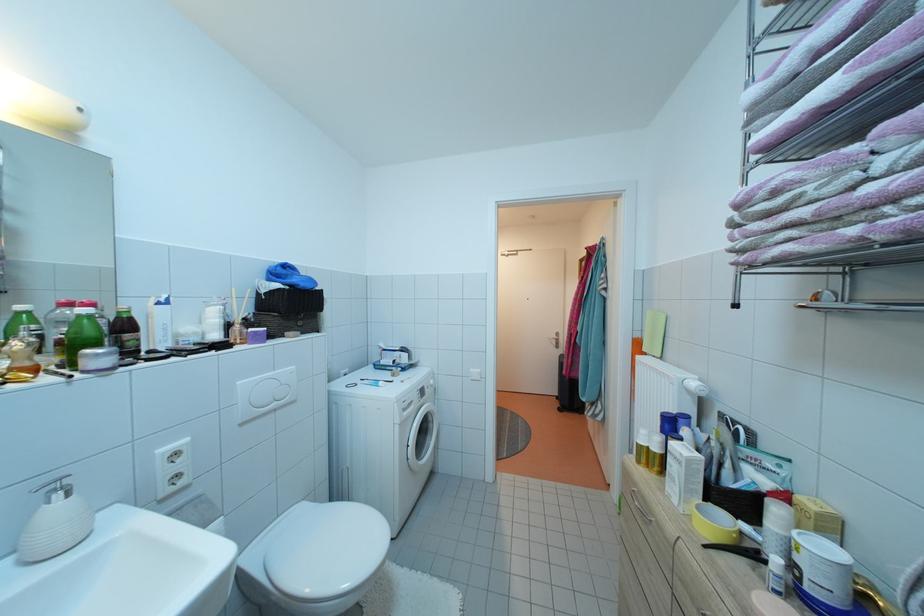
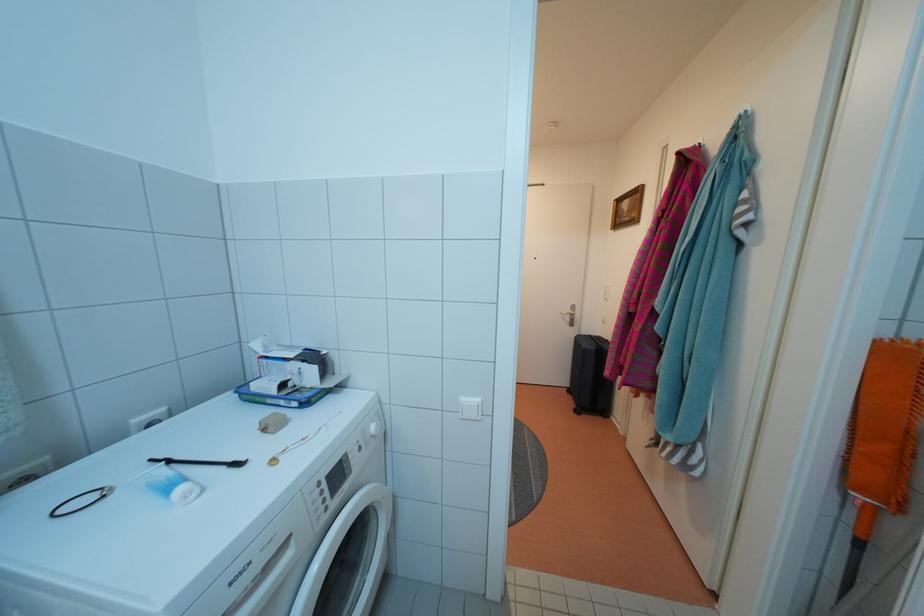
Question: In a continuous first-person perspective shot, in which direction is the camera moving?

Choices:
 (A) Left
 (B) Right
 (C) Forward
 (D) Backward

Answer: (C)